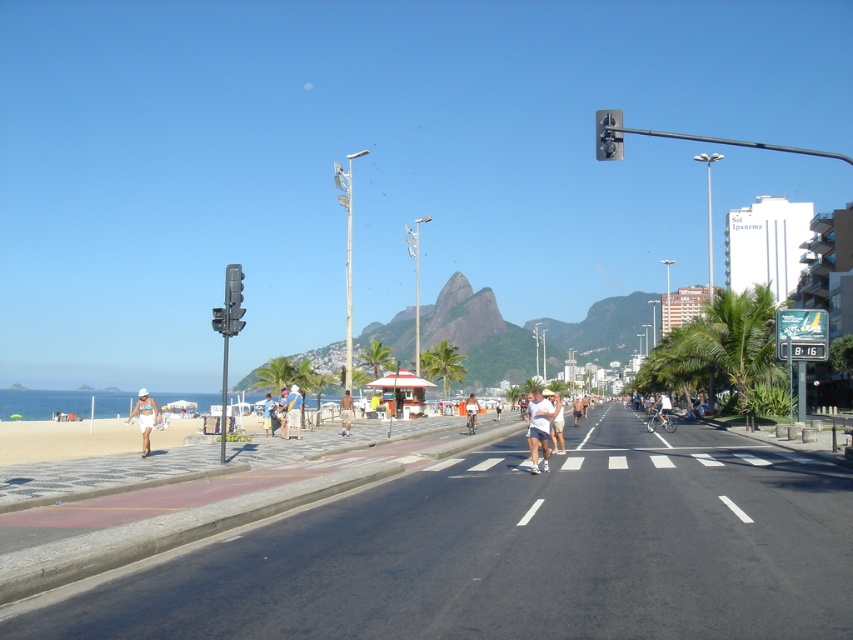
What do you see at coordinates (293, 410) in the screenshot? The height and width of the screenshot is (640, 853). I see `white cotton shirt at center` at bounding box center [293, 410].

Is point (299, 397) positioned after point (662, 417)?

No, (299, 397) is in front of (662, 417).

The image size is (853, 640). What are the coordinates of `white cotton shirt at center` in the screenshot? It's located at (293, 410).

Can you confirm if tan fabric shorts at center is bigger than light blue shorts at center?

Yes, tan fabric shorts at center is bigger than light blue shorts at center.

Who is higher up, tan fabric shorts at center or light blue shorts at center?

Positioned higher is tan fabric shorts at center.

Between point (273, 420) and point (467, 397), which one is positioned in front?

Positioned in front is point (273, 420).

You are a GUI agent. You are given a task and a screenshot of the screen. Output one action in this format:
    pyautogui.click(x=<x>, y=<y>)
    Task: Click on the tan fabric shorts at center
    
    Given the screenshot: What is the action you would take?
    pyautogui.click(x=270, y=413)

Is white matte shirt at center further to the viewer compared to light blue denim shorts at center?

No, white matte shirt at center is closer to the viewer.

I want to click on white matte shirt at center, so click(x=556, y=426).

This screenshot has width=853, height=640. In order to click on white matte shirt at center in this screenshot , I will do `click(556, 426)`.